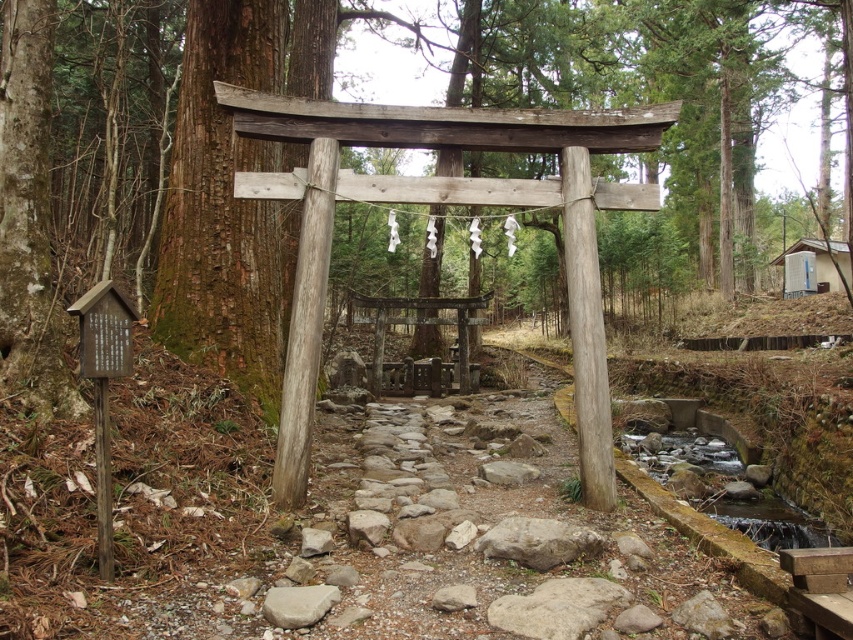
You are standing at the base of the stone pathway leading to the torii gate. You notice two points marked on the ground ahead of you. The first point is at coordinates point (534, 548), and the second is at point (291, 618). If you want to reach the point that is closer to the torii gate, which coordinate should you head towards?

Point (534, 548) is behind point (291, 618), so the point closer to the torii gate would be point (291, 618) since it is in front of the other point.

You are a hiker who wants to place both the gray rough rock at center and the smooth gray rock at lower center on a small shelf that can only hold items up to the size of the bigger one. Which rock should you choose to place on the shelf?

The gray rough rock at center is bigger than the smooth gray rock at lower center, so you should choose the smooth gray rock at lower center to place on the shelf since it is smaller and fits within the size limit.

You are a hiker carrying a backpack and need to place a 1.2 meter long stick between the gray rough rock at center and the smooth gray rock at lower center. Can you fit the stick horizontally between them without bending it?

The distance between the gray rough rock at center and the smooth gray rock at lower center is 1.14 meters. Since the stick is 1.2 meters long, it is longer than the space available, so it cannot be placed horizontally between them without bending.